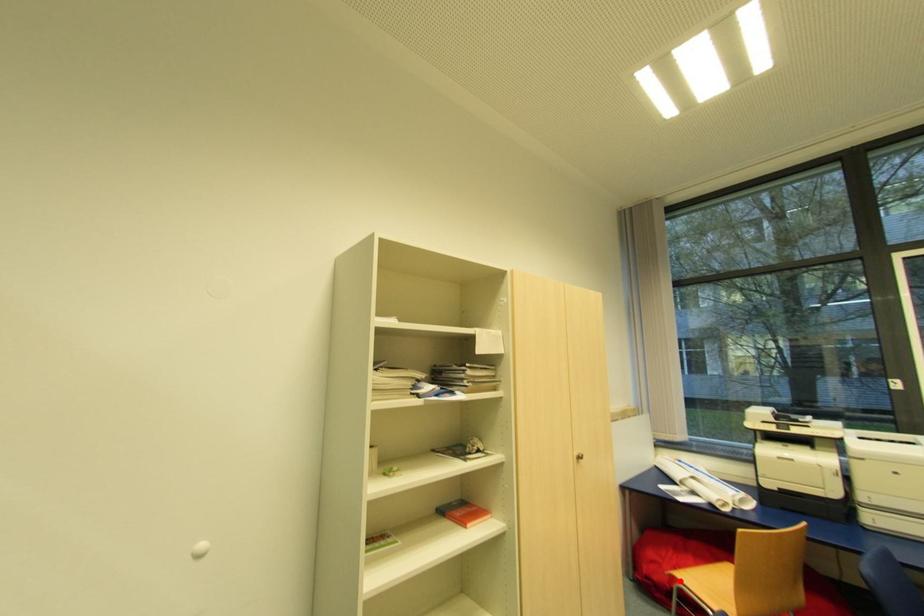
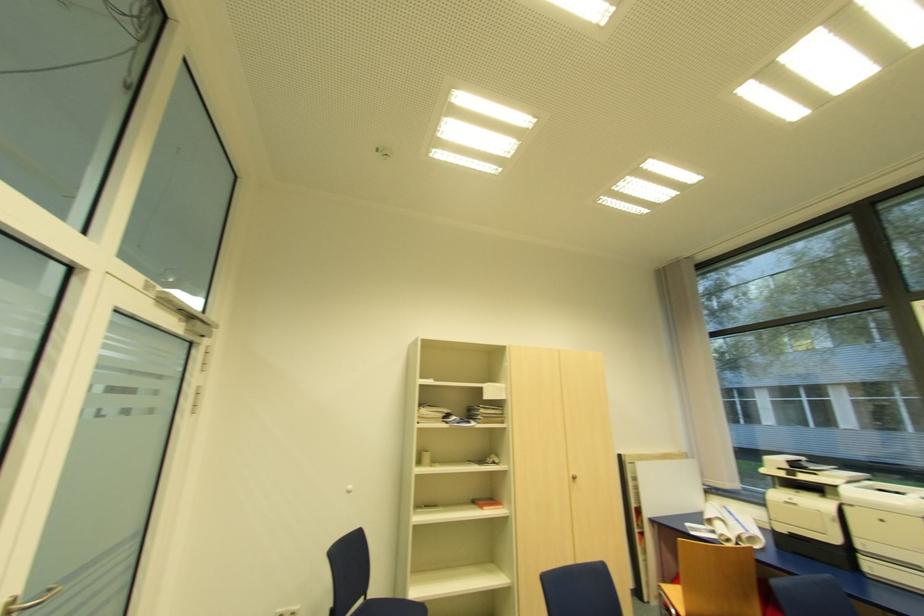
Find the pixel in the second image that matches the highlighted location in the first image.

(663, 589)